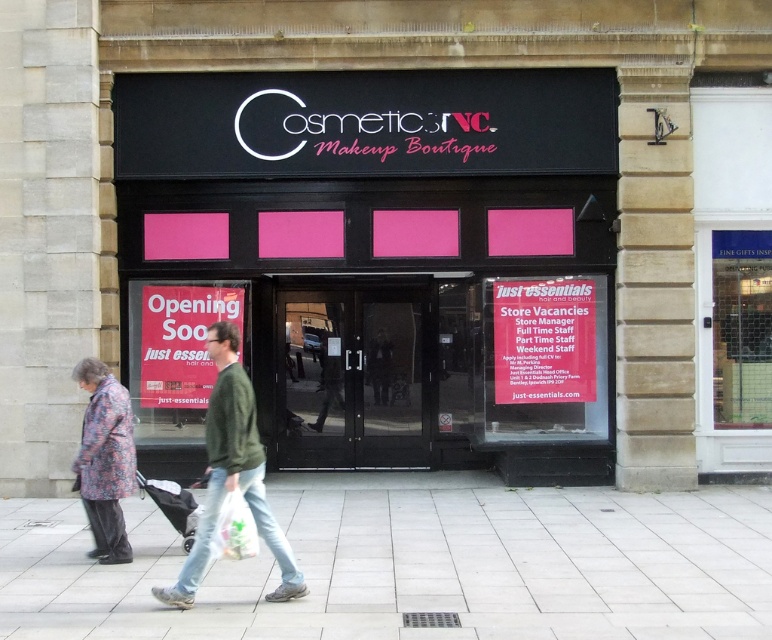
Does black matte signboard at center have a lesser height compared to floral fabric coat at lower left?

No.

Is point (540, 454) farther from viewer compared to point (85, 433)?

Yes.

Locate an element on the screen. This screenshot has width=772, height=640. black matte signboard at center is located at coordinates (381, 260).

Who is more distant from viewer, (219, 460) or (256, 536)?

The point (256, 536) is behind.

Between green cotton jacket at center and white plastic bag at lower center, which one is positioned higher?

green cotton jacket at center is higher up.

Is point (252, 480) more distant than point (225, 506)?

Yes, point (252, 480) is farther from viewer.

At what (x,y) coordinates should I click in order to perform the action: click on green cotton jacket at center. Please return your answer as a coordinate pair (x, y). This screenshot has width=772, height=640. Looking at the image, I should click on (232, 474).

Can you confirm if smooth concrete pavement at lower center is bigger than white plastic bag at lower center?

Correct, smooth concrete pavement at lower center is larger in size than white plastic bag at lower center.

Is point (205, 636) farther from camera compared to point (234, 513)?

No, it is in front of (234, 513).

I want to click on smooth concrete pavement at lower center, so click(x=415, y=563).